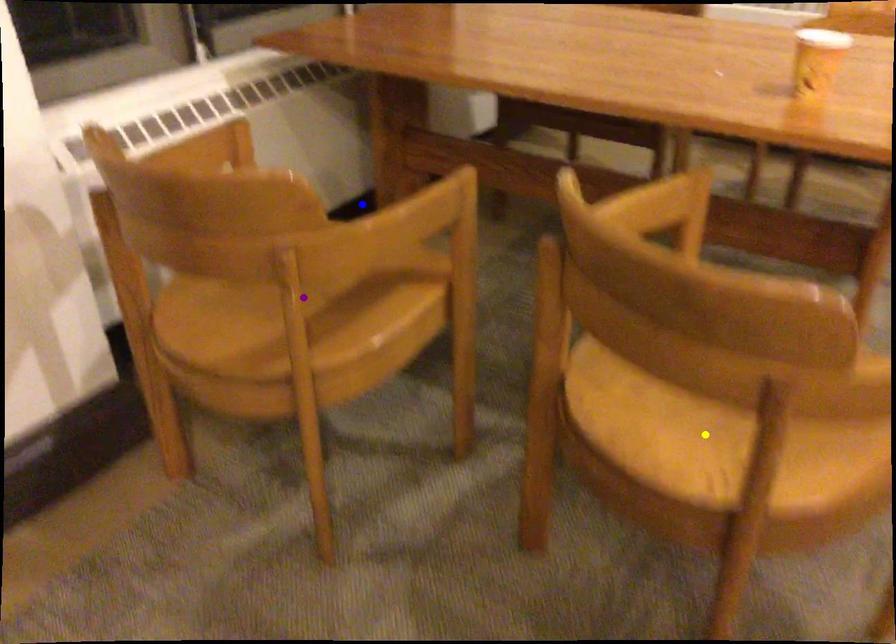
Order these from nearest to farthest:
yellow point, purple point, blue point

blue point < purple point < yellow point